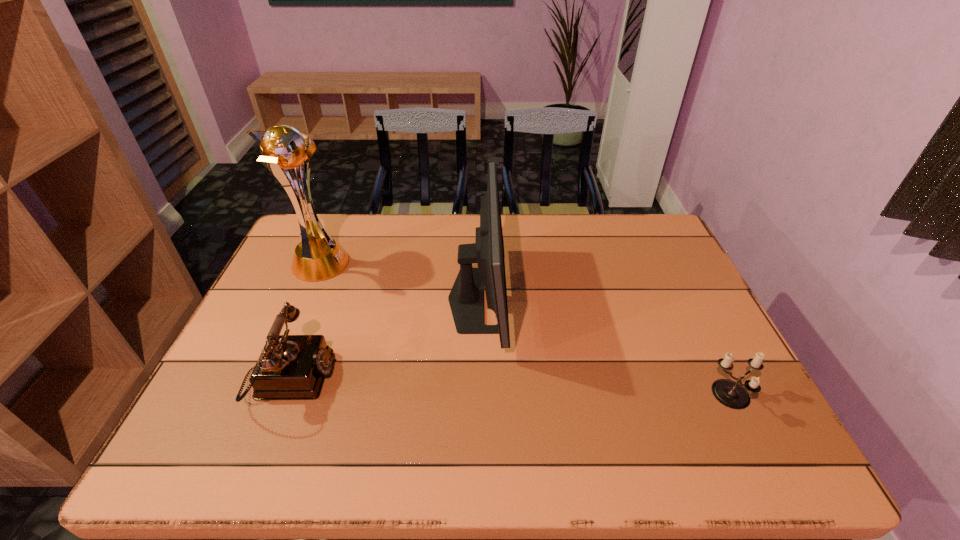
This screenshot has width=960, height=540. I want to click on vacant region between the tallest object and the rightmost object, so click(x=525, y=330).

Where is `vacant region between the rightmost object and the tallest object`? The height and width of the screenshot is (540, 960). vacant region between the rightmost object and the tallest object is located at coordinates (525, 330).

Point out which object is positioned as the third nearest to the candle holder. Please provide its 2D coordinates. Your answer should be formatted as a tuple, i.e. [(x, y)], where the tuple contains the x and y coordinates of a point satisfying the conditions above.

[(320, 257)]

Image resolution: width=960 pixels, height=540 pixels. I want to click on the second closest object to the telephone, so point(466,298).

Identify the location of free location that satisfies the following two spatial constraints: 1. on the dial of the rightmost object; 2. on the right side of the third tallest object. Image resolution: width=960 pixels, height=540 pixels. (282, 396).

Find the location of a particular element. The image size is (960, 540). vacant space that satisfies the following two spatial constraints: 1. on the front-facing side of the candle holder; 2. on the left side of the tallest object is located at coordinates (261, 396).

You are a GUI agent. You are given a task and a screenshot of the screen. Output one action in this format:
    pyautogui.click(x=<x>, y=<y>)
    Task: Click on the free spot that satisfies the following two spatial constraints: 1. on the dial of the third tallest object; 2. on the left side of the candle holder
    
    Given the screenshot: What is the action you would take?
    pyautogui.click(x=282, y=396)

The height and width of the screenshot is (540, 960). Find the location of `free space that satisfies the following two spatial constraints: 1. on the back side of the rightmost object; 2. on the screen side of the second tallest object`. free space that satisfies the following two spatial constraints: 1. on the back side of the rightmost object; 2. on the screen side of the second tallest object is located at coordinates (684, 299).

Find the location of a particular element. The width and height of the screenshot is (960, 540). free space that satisfies the following two spatial constraints: 1. on the dial of the third tallest object; 2. on the right side of the shortest object is located at coordinates (282, 396).

The image size is (960, 540). What are the coordinates of `free location that satisfies the following two spatial constraints: 1. on the screen side of the second tallest object; 2. on the back side of the candle holder` in the screenshot? It's located at (476, 396).